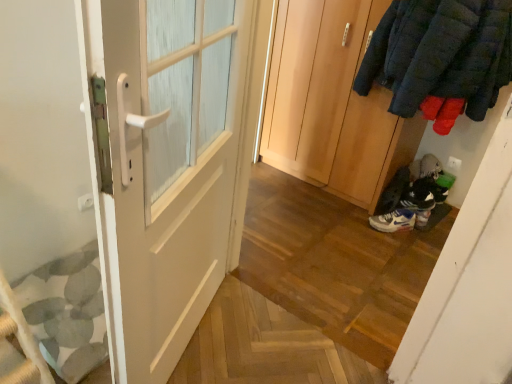
This screenshot has height=384, width=512. I want to click on vacant space situated on the left part of white matte sneaker at lower right, the first footwear viewed from the left, so click(x=356, y=220).